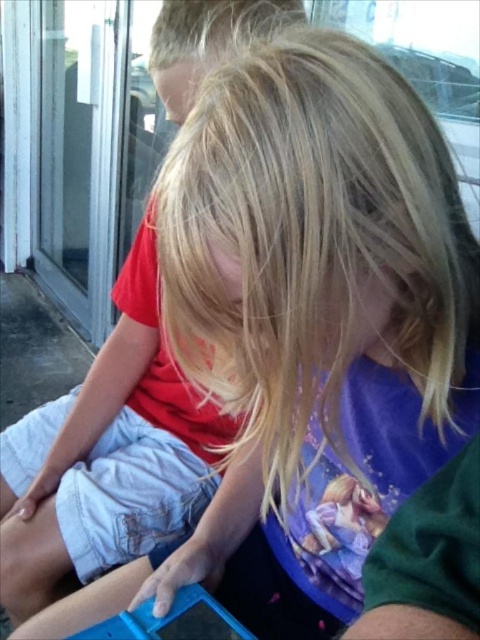
Does transparent glass door at left have a lesser height compared to blue plastic toy at lower center?

In fact, transparent glass door at left may be taller than blue plastic toy at lower center.

Does transparent glass door at left have a smaller size compared to blue plastic toy at lower center?

No, transparent glass door at left is not smaller than blue plastic toy at lower center.

Measure the distance between point (55, 256) and camera.

A distance of 9.04 feet exists between point (55, 256) and camera.

Find the location of a particular element. This screenshot has height=640, width=480. transparent glass door at left is located at coordinates (81, 160).